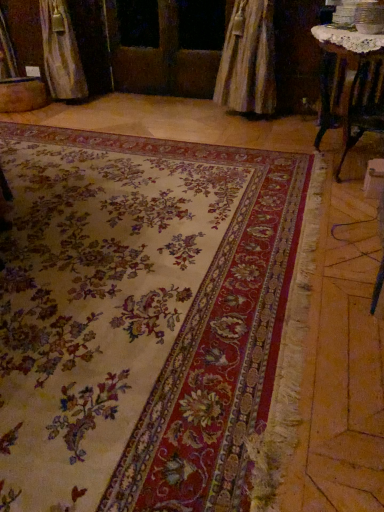
Question: From the image's perspective, does floral carpet at center appear higher than wooden screen door at center?

Choices:
 (A) yes
 (B) no

Answer: (B)

Question: Can you confirm if floral carpet at center is positioned to the right of wooden screen door at center?

Choices:
 (A) yes
 (B) no

Answer: (B)

Question: Is floral carpet at center at the left side of wooden screen door at center?

Choices:
 (A) yes
 (B) no

Answer: (A)

Question: Is floral carpet at center oriented away from wooden screen door at center?

Choices:
 (A) no
 (B) yes

Answer: (A)

Question: Could you tell me if floral carpet at center is facing wooden screen door at center?

Choices:
 (A) no
 (B) yes

Answer: (A)

Question: From a real-world perspective, is floral carpet at center physically below wooden screen door at center?

Choices:
 (A) yes
 (B) no

Answer: (A)

Question: Would you say floral carpet at center is a long distance from wooden table at upper right?

Choices:
 (A) yes
 (B) no

Answer: (A)

Question: Does floral carpet at center have a lesser width compared to wooden table at upper right?

Choices:
 (A) no
 (B) yes

Answer: (A)

Question: From a real-world perspective, is floral carpet at center below wooden table at upper right?

Choices:
 (A) no
 (B) yes

Answer: (B)

Question: Is floral carpet at center completely or partially outside of wooden table at upper right?

Choices:
 (A) yes
 (B) no

Answer: (A)

Question: Is floral carpet at center closer to camera compared to wooden table at upper right?

Choices:
 (A) yes
 (B) no

Answer: (A)

Question: Is floral carpet at center smaller than wooden table at upper right?

Choices:
 (A) no
 (B) yes

Answer: (A)

Question: Is wooden screen door at center looking in the opposite direction of wooden table at upper right?

Choices:
 (A) yes
 (B) no

Answer: (B)